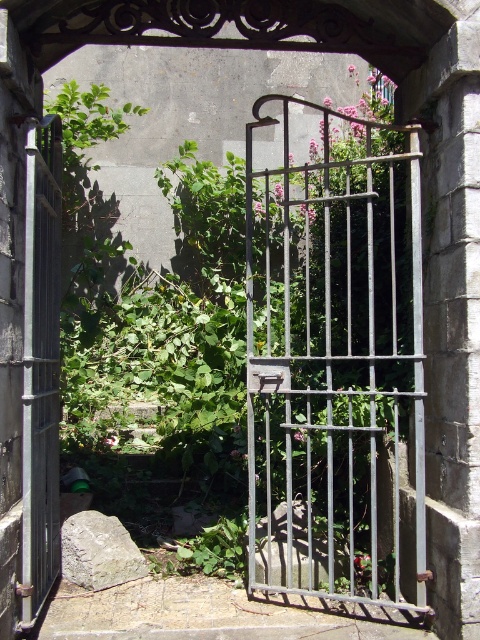
You are a drone operator trying to navigate a small drone through the archway. The drone has a camera that can only focus on two specific points in the scene. The first point is at coordinate point(x=372, y=188) and the second point is at point(x=27, y=273). Which point is closer to the entrance of the archway?

Point(x=27, y=273) is closer to the entrance of the archway because it is positioned in front of point(x=372, y=188) according to the spatial relationship provided.